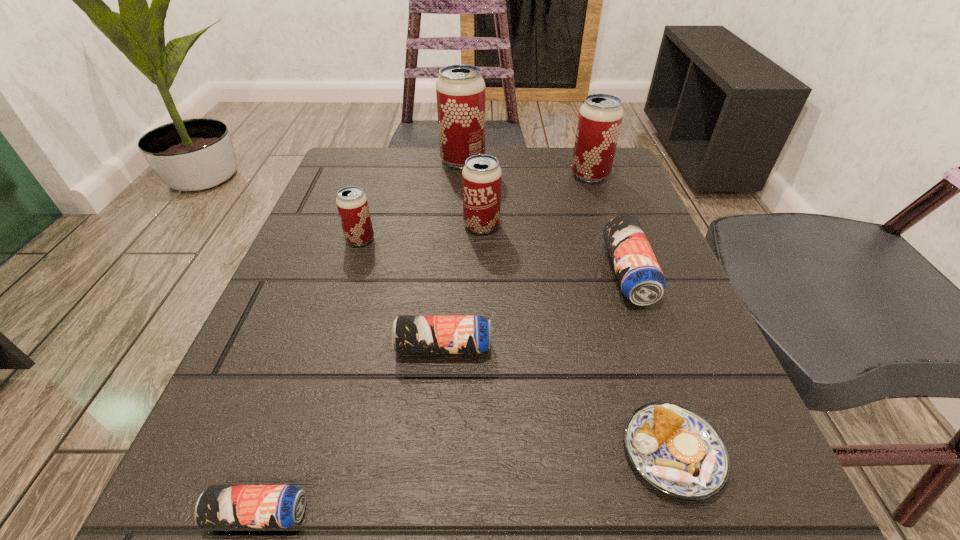
You are a GUI agent. You are given a task and a screenshot of the screen. Output one action in this format:
    pyautogui.click(x=<x>, y=<y>)
    Task: Click on the red beer can that is the closest to the second biggest blue beer can
    
    Given the screenshot: What is the action you would take?
    pyautogui.click(x=352, y=204)

Where is `blue beer can that is the nearest to the rightmost blue beer can`? blue beer can that is the nearest to the rightmost blue beer can is located at coordinates (410, 334).

Find the location of a particular element. blue beer can that is the closest to the nearest beer can is located at coordinates (410, 334).

At what (x,y) coordinates should I click in order to perform the action: click on free location that satisfies the following two spatial constraints: 1. on the front side of the fourth shortest object; 2. on the left side of the sixth shortest object. Please return your answer as a coordinate pair (x, y). Image resolution: width=960 pixels, height=540 pixels. Looking at the image, I should click on (482, 273).

This screenshot has height=540, width=960. In order to click on blank space that satisfies the following two spatial constraints: 1. on the front side of the second biggest red beer can; 2. on the left side of the fourth shortest object in this screenshot , I will do tap(625, 273).